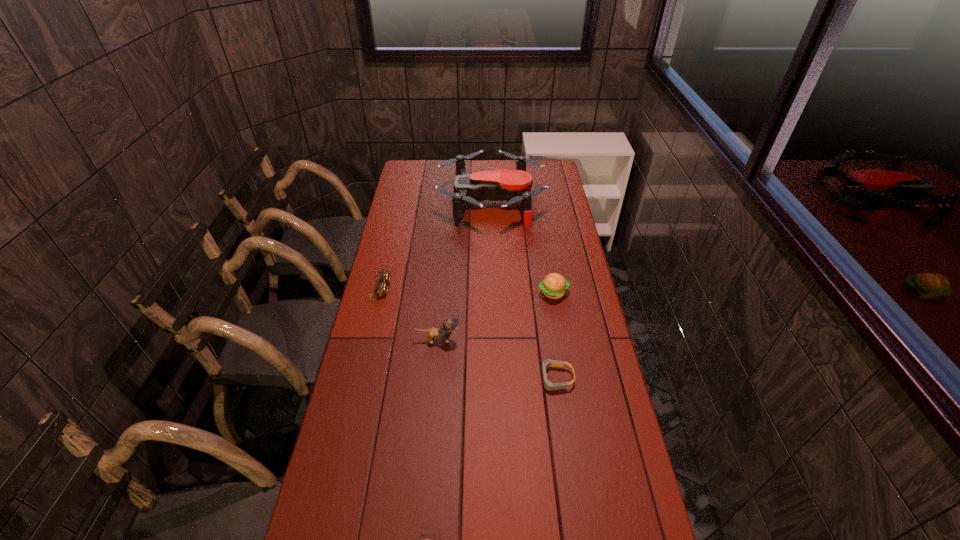
You are a GUI agent. You are given a task and a screenshot of the screen. Output one action in this format:
    pyautogui.click(x=<x>, y=<y>)
    Task: Click on the free space that is in between the second nearest object and the third nearest object
    
    Given the screenshot: What is the action you would take?
    tap(496, 359)

Where is `vacant region between the kitten and the fourth shortest object`? vacant region between the kitten and the fourth shortest object is located at coordinates (495, 316).

This screenshot has width=960, height=540. Find the location of `vacant point located between the fifth farthest object and the leftmost object`. vacant point located between the fifth farthest object and the leftmost object is located at coordinates (468, 333).

This screenshot has height=540, width=960. I want to click on vacant area that lies between the tallest goggles and the rightmost goggles, so click(x=468, y=333).

What are the coordinates of `free spot between the second farthest goggles and the fourth shortest object` in the screenshot? It's located at (554, 335).

Locate an element on the screen. The image size is (960, 540). the second closest object to the second tallest object is located at coordinates (548, 385).

Point out which object is positioned as the second nearest to the farthest goggles. Please provide its 2D coordinates. Your answer should be formatted as a tuple, i.e. [(x, y)], where the tuple contains the x and y coordinates of a point satisfying the conditions above.

[(513, 186)]

Identify which goggles is the closest to the nearest goggles. Please provide its 2D coordinates. Your answer should be formatted as a tuple, i.e. [(x, y)], where the tuple contains the x and y coordinates of a point satisfying the conditions above.

[(548, 385)]

Point out which goggles is positioned as the second nearest to the farthest goggles. Please provide its 2D coordinates. Your answer should be formatted as a tuple, i.e. [(x, y)], where the tuple contains the x and y coordinates of a point satisfying the conditions above.

[(418, 539)]

Identify the location of vacant region that satisfies the following two spatial constraints: 1. on the camera side of the drone; 2. on the back side of the hamburger. This screenshot has height=540, width=960. (493, 293).